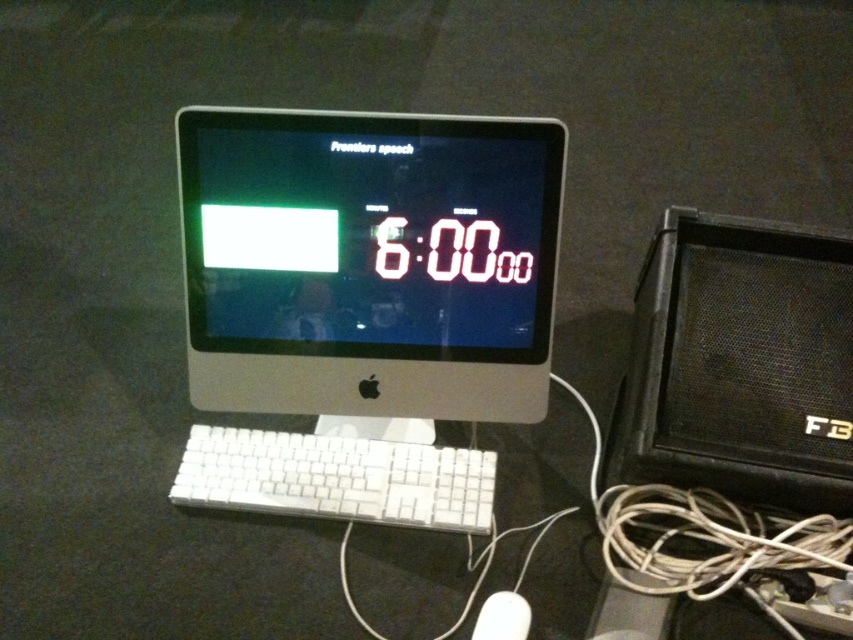
You are setting up a home theater system. You have a white plastic monitor at center and a black textured speaker at right. Which device is closer to you when standing in front of the workspace?

The white plastic monitor at center is closer to you because the black textured speaker at right is behind it.

You are an assistant who needs to adjust the lighting in the workspace. You have two points marked on the ceiling for installing a spotlight. The first point is at coordinates point [339,316] and the second is at point [782,392]. Which point would cast a shadow of the speaker towards the iMac?

Point [339,316] is behind point [782,392], so placing the spotlight at point [339,316] would cast the shadow of the speaker towards the iMac.

What is the 2D coordinate of the black textured speaker at right?

The 2D coordinate of the black textured speaker at right is at point (740,364).